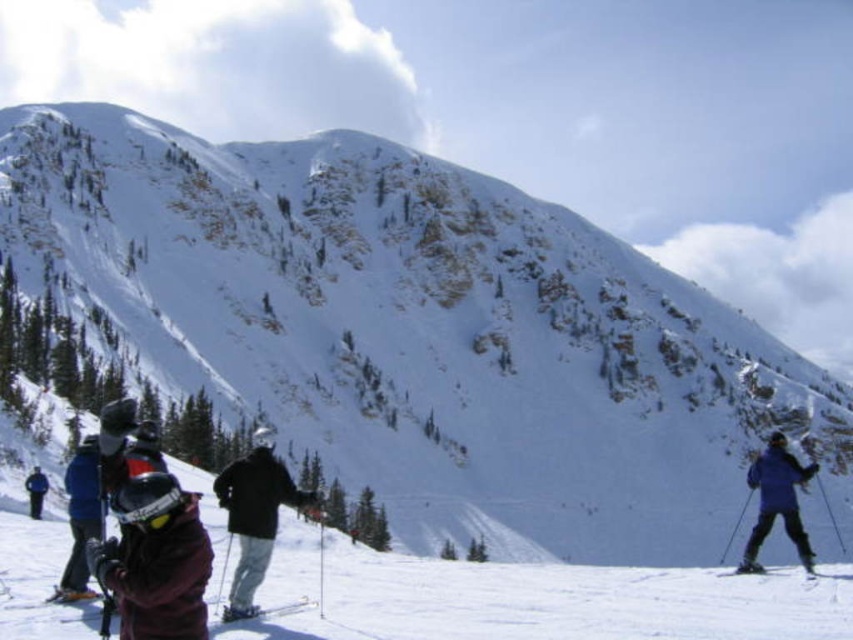
Question: Can you confirm if purple matte jacket at lower right is thinner than blue fabric jacket at lower left?

Choices:
 (A) yes
 (B) no

Answer: (B)

Question: Which object is farther from the camera taking this photo?

Choices:
 (A) purple matte jacket at lower right
 (B) black matte jacket at center
 (C) metallic silver ski at lower center
 (D) shiny black ski at lower right

Answer: (A)

Question: Is shiny black ski at lower right to the left of blue jacket at lower left from the viewer's perspective?

Choices:
 (A) yes
 (B) no

Answer: (B)

Question: Which point appears farthest from the camera in this image?

Choices:
 (A) (762, 570)
 (B) (125, 518)
 (C) (270, 483)

Answer: (A)

Question: Considering the relative positions of shiny black ski at lower right and blue jacket at lower left in the image provided, where is shiny black ski at lower right located with respect to blue jacket at lower left?

Choices:
 (A) right
 (B) left

Answer: (A)

Question: Which object is farther from the camera taking this photo?

Choices:
 (A) blue jacket at lower left
 (B) purple matte jacket at lower right
 (C) black matte jacket at center

Answer: (A)